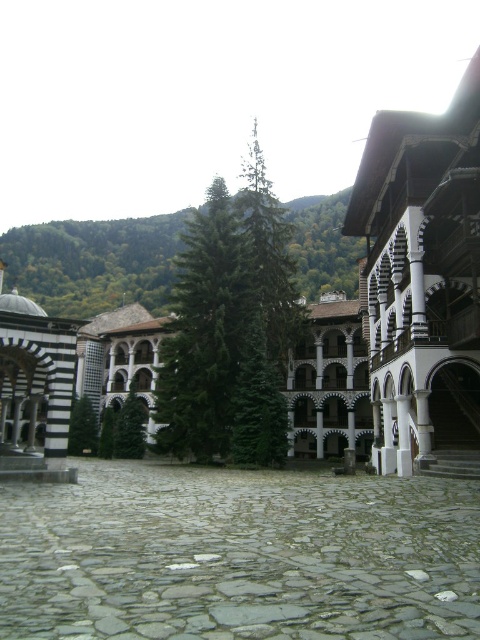
You are standing on the cobblestone pathway in the courtyard and want to walk towards the gray stone courtyard at center. Which direction should you walk to avoid the green matte tree at center?

The gray stone courtyard at center is above the green matte tree at center, so you should walk towards the direction of the gray stone courtyard at center to avoid the green matte tree at center.

You are a visitor in the courtyard and want to know which area is wider between the gray stone courtyard at center and the white wood palace at right. Based on the scene, which one is wider?

The gray stone courtyard at center is wider than the white wood palace at right according to the description provided.